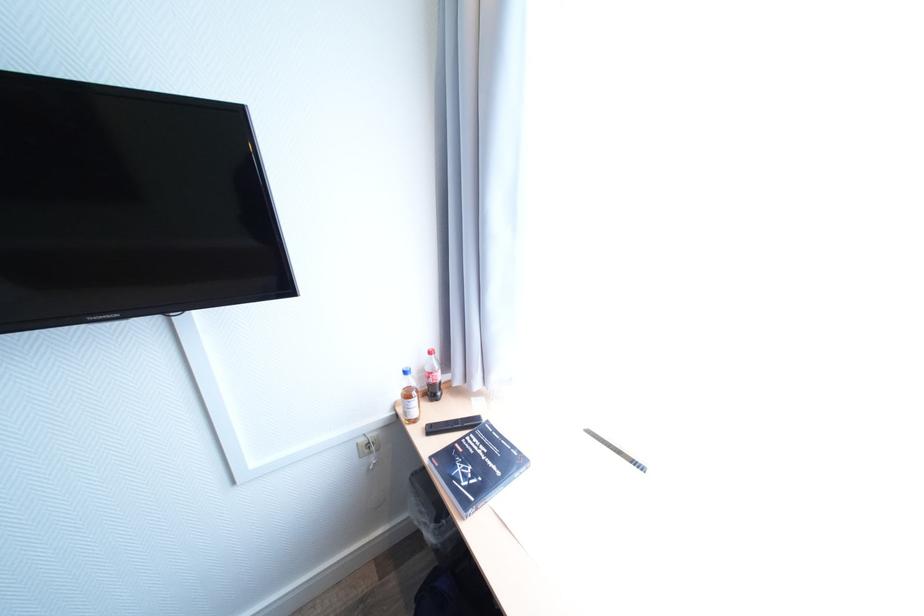
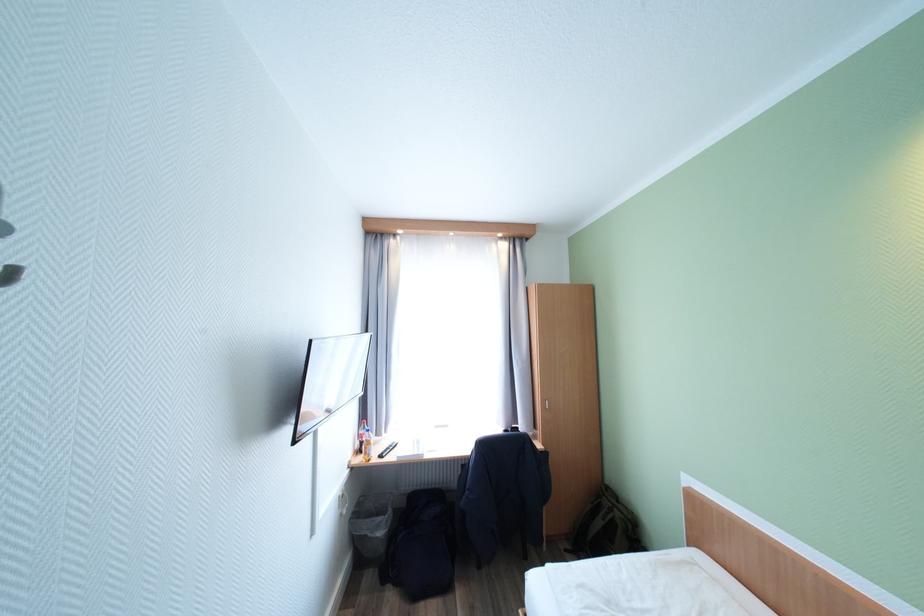
Question: I am providing you with two images of the same scene from different viewpoints. Which of the following objects are not visible in image2?

Choices:
 (A) black remote control
 (B) blue backpack
 (C) red bottle cap
 (D) dark sofa surface

Answer: (C)